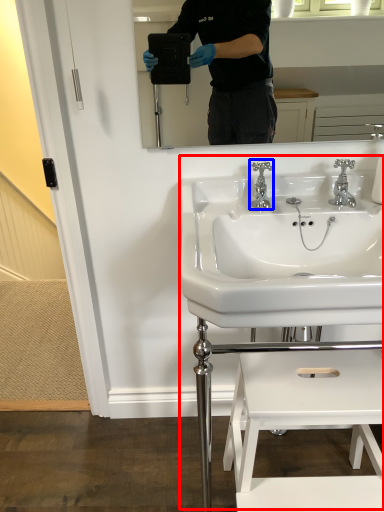
Question: Which object is closer to the camera taking this photo, sink (highlighted by a red box) or tap (highlighted by a blue box)?

Choices:
 (A) sink
 (B) tap

Answer: (A)